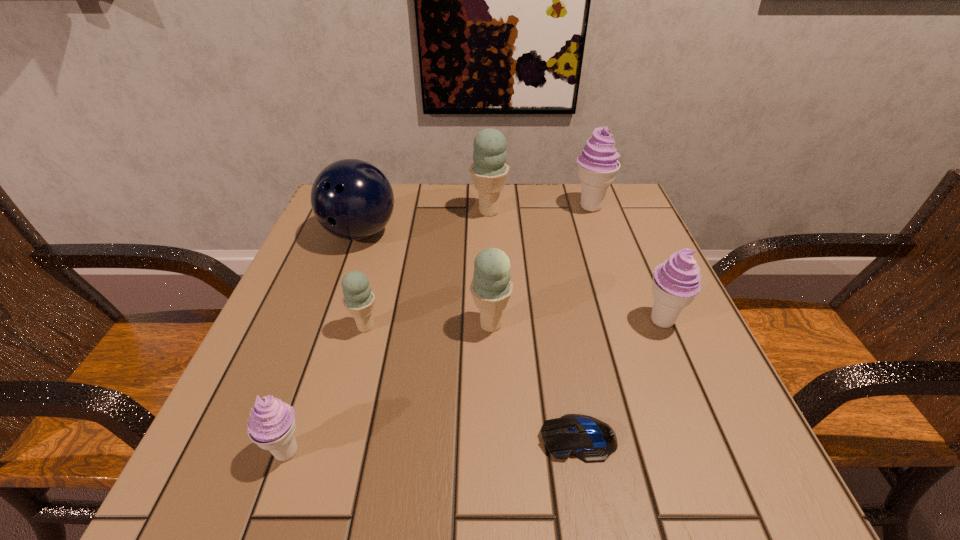
Locate an element on the screen. The image size is (960, 540). vacant region located on the button side of the computer mouse is located at coordinates (347, 438).

You are a GUI agent. You are given a task and a screenshot of the screen. Output one action in this format:
    pyautogui.click(x=<x>, y=<y>)
    Task: Click on the bowling ball situated at the far edge
    Image resolution: width=960 pixels, height=540 pixels.
    Given the screenshot: What is the action you would take?
    pyautogui.click(x=352, y=199)

Locate an element on the screen. This screenshot has width=960, height=540. icecream that is positioned at the near edge is located at coordinates click(x=271, y=425).

Identify the location of computer mouse at the near edge. This screenshot has width=960, height=540. (591, 440).

This screenshot has height=540, width=960. Identify the location of bowling ball located at the left edge. (352, 199).

This screenshot has height=540, width=960. Find the location of `object present at the far left corner`. object present at the far left corner is located at coordinates (352, 199).

Locate an element on the screen. This screenshot has height=540, width=960. object that is at the near left corner is located at coordinates (271, 425).

This screenshot has width=960, height=540. In order to click on object located in the far right corner section of the desktop in this screenshot , I will do `click(598, 165)`.

What are the coordinates of `free region at the far edge of the desktop` in the screenshot? It's located at (465, 201).

Find the location of a particular element. The image size is (960, 540). free space at the near edge of the desktop is located at coordinates (320, 506).